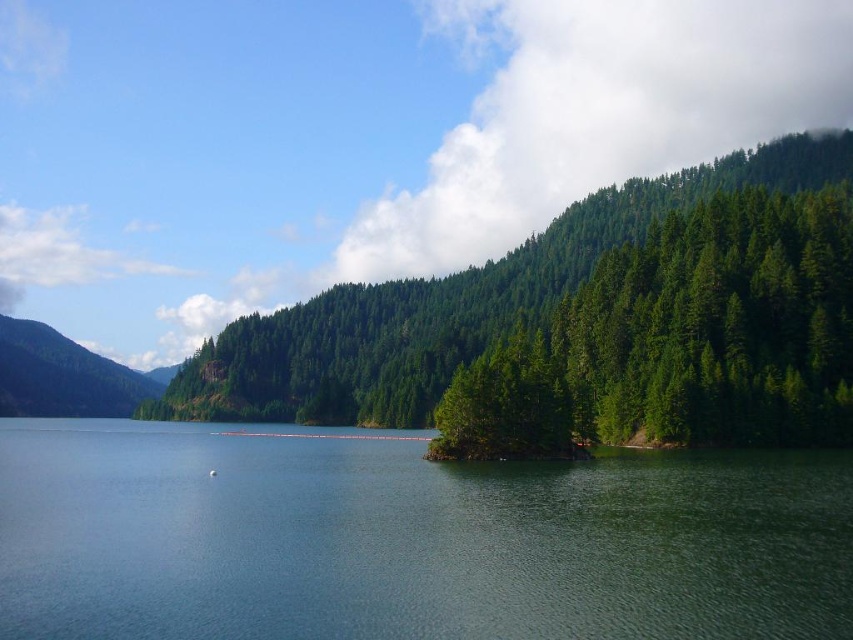
Question: Which of the following is the closest to the observer?

Choices:
 (A) (309, 358)
 (B) (796, 378)
 (C) (32, 401)

Answer: (B)

Question: Does green matte tree at center appear on the left side of green forested mountain at left?

Choices:
 (A) yes
 (B) no

Answer: (B)

Question: Which object is positioned closest to the green forested mountain at left?

Choices:
 (A) green matte tree at center
 (B) green matte trees at right

Answer: (A)

Question: Is the position of green smooth water at center more distant than that of green matte tree at center?

Choices:
 (A) no
 (B) yes

Answer: (A)

Question: Which point appears farthest from the camera in this image?

Choices:
 (A) (151, 396)
 (B) (730, 188)

Answer: (A)

Question: Is green smooth water at center positioned in front of green matte trees at right?

Choices:
 (A) no
 (B) yes

Answer: (B)